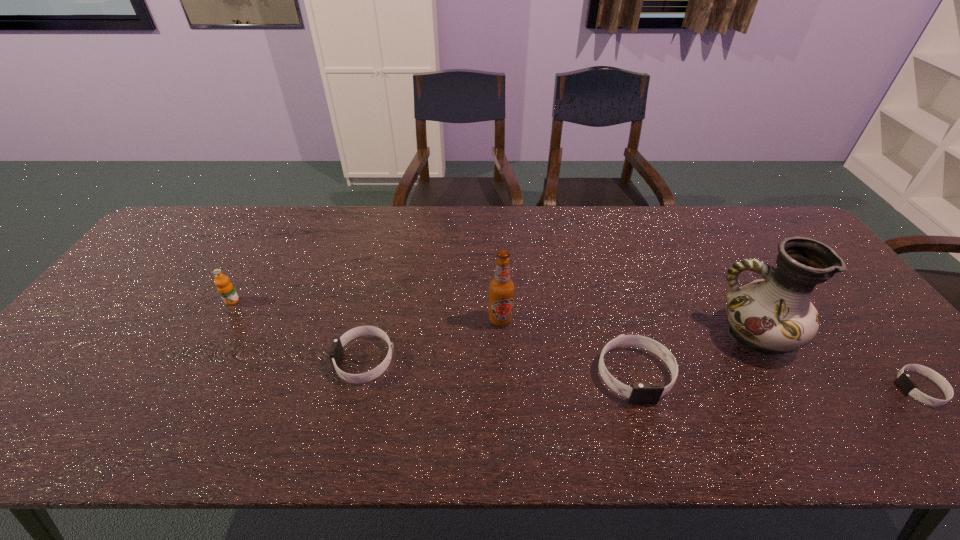
Locate an element on the screen. vacant spot to place a wristband on the left is located at coordinates (109, 347).